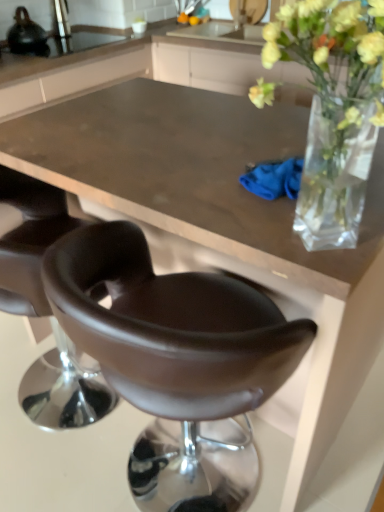
Question: Can you confirm if translucent glass vase at upper right is thinner than leather-like brown chair at lower left, which is the second chair from right to left?

Choices:
 (A) no
 (B) yes

Answer: (B)

Question: Is translucent glass vase at upper right oriented away from leather-like brown chair at lower left, which is the second chair from right to left?

Choices:
 (A) no
 (B) yes

Answer: (A)

Question: Does translucent glass vase at upper right appear on the right side of leather-like brown chair at lower left, the first chair when ordered from left to right?

Choices:
 (A) no
 (B) yes

Answer: (B)

Question: Is translucent glass vase at upper right bigger than leather-like brown chair at lower left, the first chair when ordered from left to right?

Choices:
 (A) no
 (B) yes

Answer: (A)

Question: Can leather-like brown chair at lower left, the first chair when ordered from left to right, be found inside translucent glass vase at upper right?

Choices:
 (A) yes
 (B) no

Answer: (B)

Question: From their relative heights in the image, would you say brown leather chair at center, placed as the 1th chair when sorted from right to left, is taller or shorter than leather-like brown chair at lower left, the first chair when ordered from left to right?

Choices:
 (A) tall
 (B) short

Answer: (A)

Question: Considering the positions of brown leather chair at center, placed as the 1th chair when sorted from right to left, and leather-like brown chair at lower left, the first chair when ordered from left to right, in the image, is brown leather chair at center, placed as the 1th chair when sorted from right to left, wider or thinner than leather-like brown chair at lower left, the first chair when ordered from left to right,?

Choices:
 (A) wide
 (B) thin

Answer: (B)

Question: From the image's perspective, is brown leather chair at center, which is the second chair from left to right, above or below leather-like brown chair at lower left, the first chair when ordered from left to right?

Choices:
 (A) below
 (B) above

Answer: (A)

Question: In the image, is brown leather chair at center, placed as the 1th chair when sorted from right to left, positioned in front of or behind leather-like brown chair at lower left, which is the second chair from right to left?

Choices:
 (A) front
 (B) behind

Answer: (A)

Question: Based on their sizes in the image, would you say leather-like brown chair at lower left, the first chair when ordered from left to right, is bigger or smaller than translucent glass vase at upper right?

Choices:
 (A) small
 (B) big

Answer: (B)

Question: From the image's perspective, is leather-like brown chair at lower left, which is the second chair from right to left, positioned above or below translucent glass vase at upper right?

Choices:
 (A) above
 (B) below

Answer: (B)

Question: From a real-world perspective, is leather-like brown chair at lower left, the first chair when ordered from left to right, physically located above or below translucent glass vase at upper right?

Choices:
 (A) below
 (B) above

Answer: (A)

Question: Is point (8, 261) positioned closer to the camera than point (316, 102)?

Choices:
 (A) closer
 (B) farther

Answer: (B)

Question: Considering the relative positions of brown leather chair at center, placed as the 1th chair when sorted from right to left, and shiny black kettle at upper left in the image provided, is brown leather chair at center, placed as the 1th chair when sorted from right to left, to the left or to the right of shiny black kettle at upper left?

Choices:
 (A) left
 (B) right

Answer: (B)

Question: From the image's perspective, is brown leather chair at center, placed as the 1th chair when sorted from right to left, above or below shiny black kettle at upper left?

Choices:
 (A) below
 (B) above

Answer: (A)